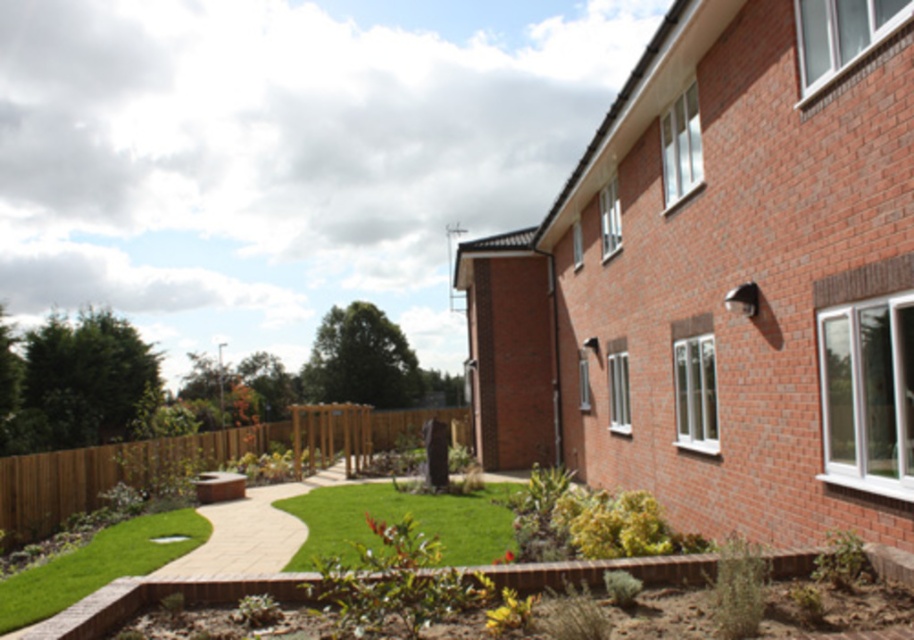
Does brown wooden fence at lower center appear over green artificial turf at lower left?

Actually, brown wooden fence at lower center is below green artificial turf at lower left.

Where is `brown wooden fence at lower center`? brown wooden fence at lower center is located at coordinates tap(194, 460).

Who is more distant from viewer, [365,444] or [83,556]?

The point [365,444] is more distant.

The height and width of the screenshot is (640, 914). Find the location of `brown wooden fence at lower center`. brown wooden fence at lower center is located at coordinates (194, 460).

Looking at this image, is brown wooden fence at lower center to the right of green lawn at center from the viewer's perspective?

No, brown wooden fence at lower center is not to the right of green lawn at center.

Does brown wooden fence at lower center have a larger size compared to green lawn at center?

Indeed, brown wooden fence at lower center has a larger size compared to green lawn at center.

Which is behind, point (316, 436) or point (430, 516)?

The point (316, 436) is behind.

Locate an element on the screen. brown wooden fence at lower center is located at coordinates (194, 460).

Between point (381, 493) and point (119, 570), which one is positioned in front?

Point (119, 570) is more forward.

Between green lawn at center and green artificial turf at lower left, which one appears on the right side from the viewer's perspective?

green lawn at center is more to the right.

Is point (433, 534) farther from viewer compared to point (37, 580)?

Yes, point (433, 534) is farther from viewer.

Locate an element on the screen. green lawn at center is located at coordinates (400, 518).